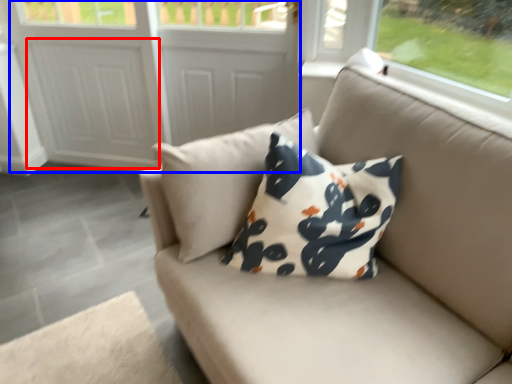
Question: Which point is closer to the camera, screen door (highlighted by a red box) or screen door (highlighted by a blue box)?

Choices:
 (A) screen door
 (B) screen door

Answer: (B)